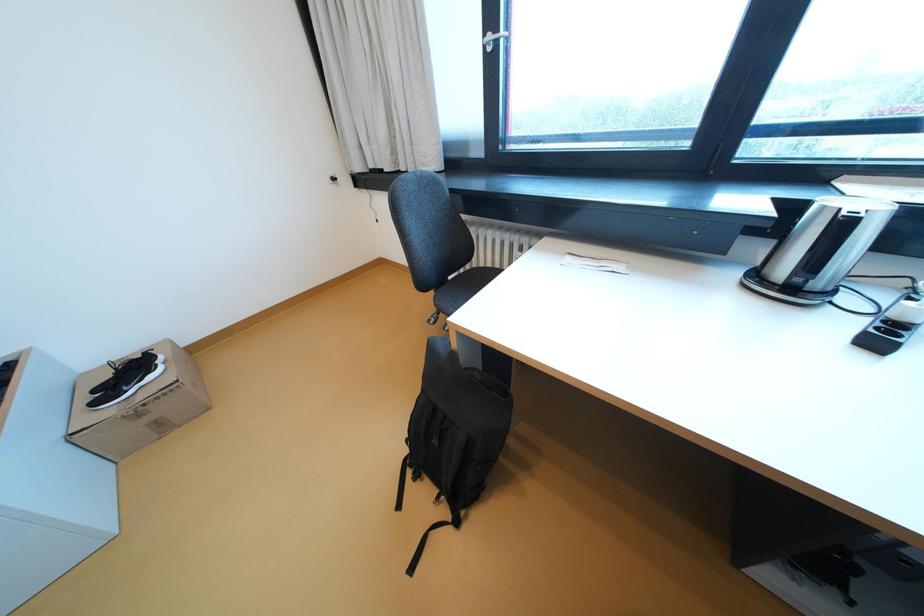
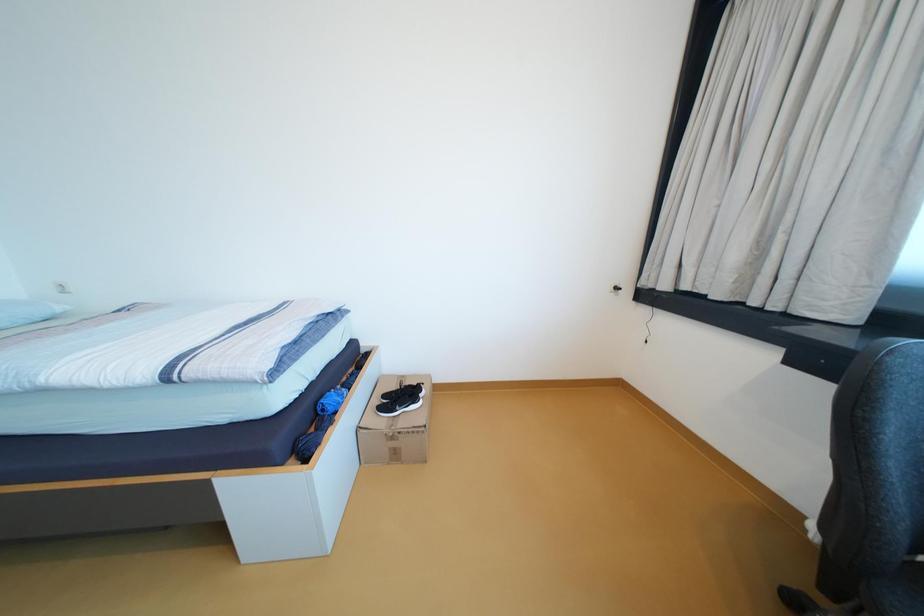
Question: The first image is from the beginning of the video and the second image is from the end. How did the camera likely rotate when shooting the video?

Choices:
 (A) Left
 (B) Right
 (C) Up
 (D) Down

Answer: (A)